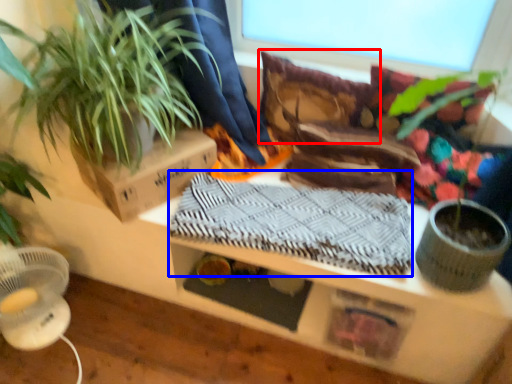
Question: Which object appears farthest to the camera in this image, pillow (highlighted by a red box) or blanket (highlighted by a blue box)?

Choices:
 (A) pillow
 (B) blanket

Answer: (A)